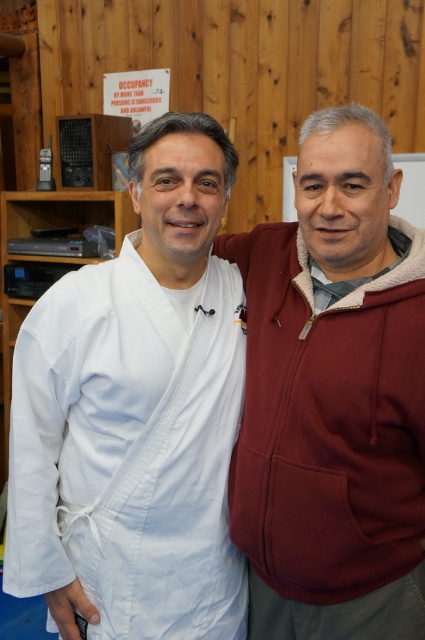
Question: Which point appears farthest from the camera in this image?

Choices:
 (A) (79, 492)
 (B) (328, 508)
 (C) (292, 163)

Answer: (C)

Question: Does maroon fleece jacket at right appear on the right side of white cotton lab coat at left?

Choices:
 (A) yes
 (B) no

Answer: (A)

Question: Where is maroon fleece jacket at right located in relation to matte wood bulletin board at upper center in the image?

Choices:
 (A) right
 (B) left

Answer: (B)

Question: Based on their relative distances, which object is nearer to the matte wood bulletin board at upper center?

Choices:
 (A) white cotton lab coat at left
 (B) maroon fleece jacket at right

Answer: (B)

Question: Which point appears farthest from the camera in this image?

Choices:
 (A) (x=401, y=216)
 (B) (x=402, y=579)

Answer: (A)

Question: In this image, where is maroon fleece jacket at right located relative to white cotton lab coat at left?

Choices:
 (A) above
 (B) below

Answer: (A)